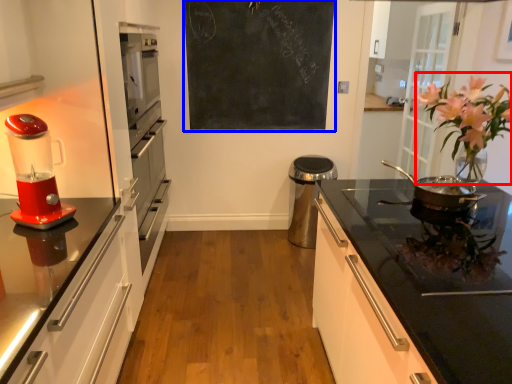
Question: Which point is further to the camera, floral arrangement (highlighted by a red box) or bulletin board (highlighted by a blue box)?

Choices:
 (A) floral arrangement
 (B) bulletin board

Answer: (B)